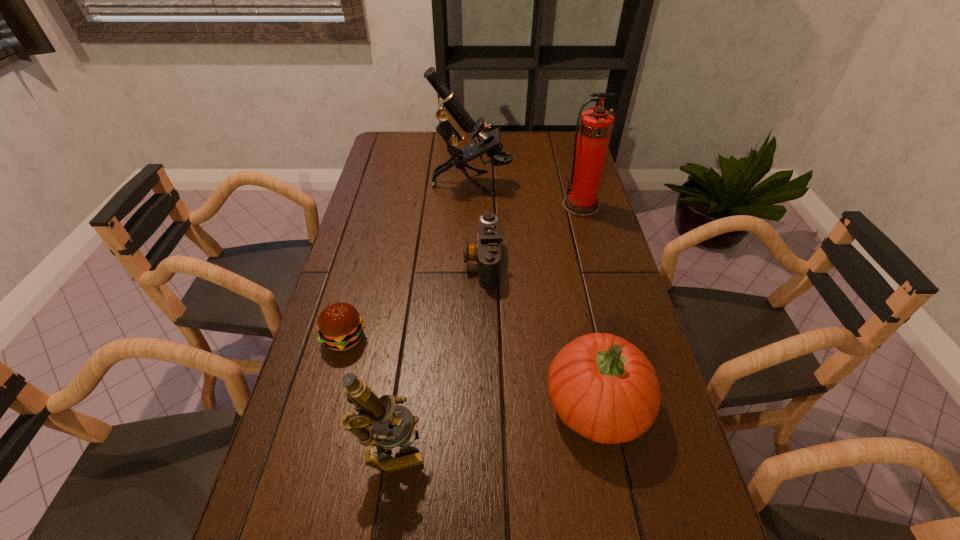
The height and width of the screenshot is (540, 960). I want to click on the farther microscope, so click(x=454, y=120).

Identify the location of fire extinguisher. The width and height of the screenshot is (960, 540). [x=590, y=149].

Find the location of a particular element. This screenshot has height=540, width=960. the nearer microscope is located at coordinates (375, 413).

Locate an element on the screen. This screenshot has width=960, height=540. the shorter microscope is located at coordinates (375, 413).

At what (x,y) coordinates should I click in order to perform the action: click on pumpkin. Please return your answer as a coordinate pair (x, y). Looking at the image, I should click on tap(603, 387).

You are a GUI agent. You are given a task and a screenshot of the screen. Output one action in this format:
    pyautogui.click(x=<x>, y=<y>)
    Task: Click on the camera
    The image size is (960, 540).
    Given the screenshot: What is the action you would take?
    click(487, 252)

Identify the location of the fourth farthest object. (340, 326).

Locate an element on the screen. This screenshot has width=960, height=540. hamburger is located at coordinates (340, 326).

What are the coordinates of `vacant region located 0.060m through the eyepiece of the taller microscope` in the screenshot? It's located at (528, 183).

Image resolution: width=960 pixels, height=540 pixels. I want to click on vacant area situated at the discharge end of the fire extinguisher, so click(x=592, y=247).